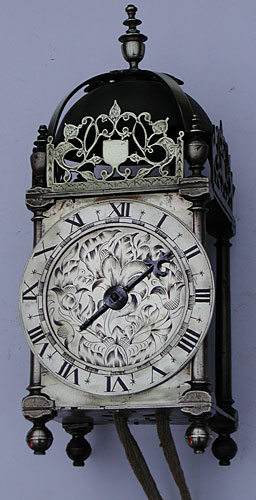
Locate an element on the screen. The image size is (256, 500). pointer of clock minute hand is located at coordinates (162, 258).